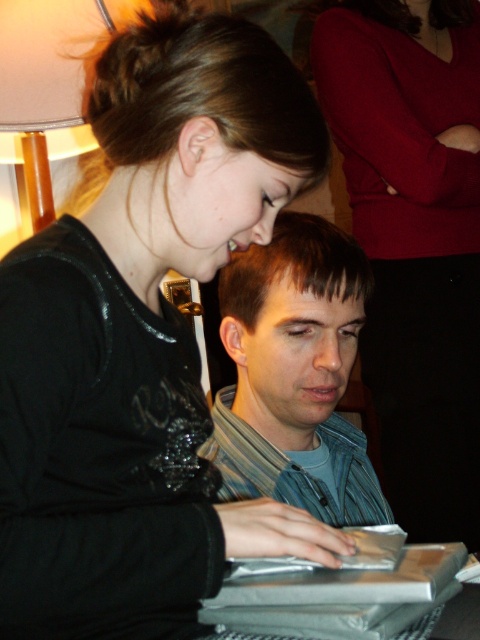
Who is positioned more to the left, black leather jacket at upper left or white fabric lampshade at upper left?

white fabric lampshade at upper left is more to the left.

Which of these two, black leather jacket at upper left or white fabric lampshade at upper left, stands shorter?

white fabric lampshade at upper left

The height and width of the screenshot is (640, 480). I want to click on black leather jacket at upper left, so click(x=144, y=339).

In the scene shown: Is matte black sweater at upper left to the right of denim jacket at center from the viewer's perspective?

Indeed, matte black sweater at upper left is positioned on the right side of denim jacket at center.

Does matte black sweater at upper left appear on the left side of denim jacket at center?

In fact, matte black sweater at upper left is to the right of denim jacket at center.

The image size is (480, 640). What do you see at coordinates (414, 243) in the screenshot? I see `matte black sweater at upper left` at bounding box center [414, 243].

Locate an element on the screen. matte black sweater at upper left is located at coordinates (414, 243).

Which is behind, point (451, 365) or point (36, 225)?

The point (36, 225) is more distant.

This screenshot has width=480, height=640. I want to click on matte black sweater at upper left, so click(x=414, y=243).